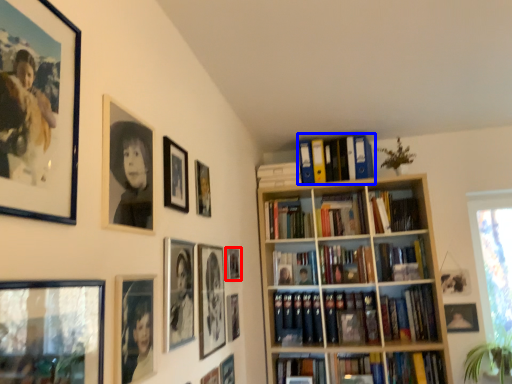
Question: Which object is closer to the camera taking this photo, picture frame (highlighted by a red box) or book (highlighted by a blue box)?

Choices:
 (A) picture frame
 (B) book

Answer: (A)